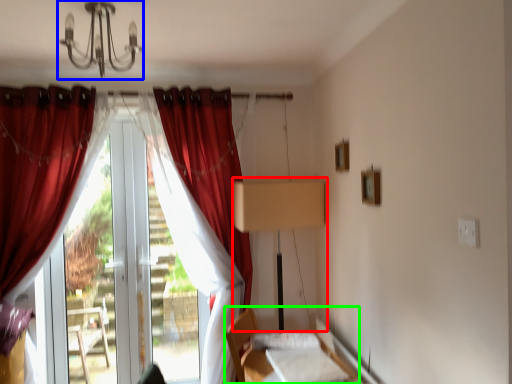
Question: Estimate the real-world distances between objects in this image. Which object is closer to table lamp (highlighted by a red box), light fixture (highlighted by a blue box) or bed (highlighted by a green box)?

Choices:
 (A) light fixture
 (B) bed

Answer: (B)